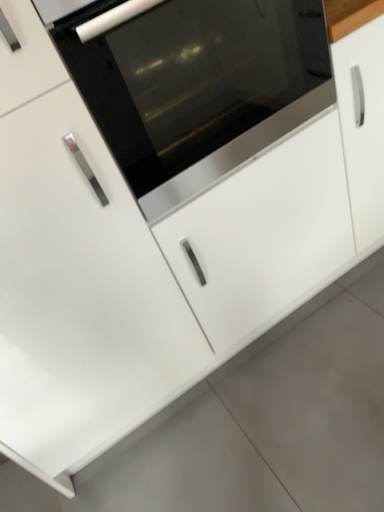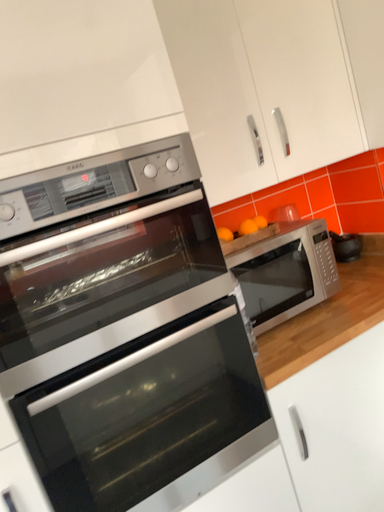
Question: Which way did the camera rotate in the video?

Choices:
 (A) rotated downward
 (B) rotated upward

Answer: (B)